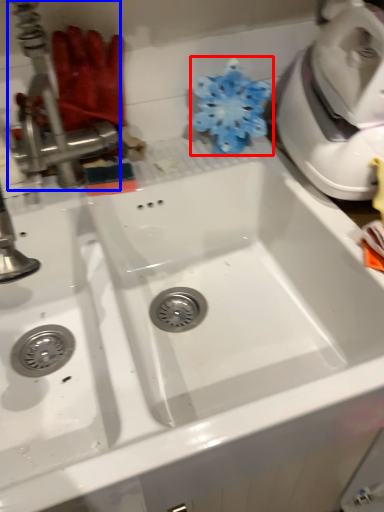
Question: Which point is further to the camera, flower (highlighted by a red box) or tap (highlighted by a blue box)?

Choices:
 (A) flower
 (B) tap

Answer: (A)